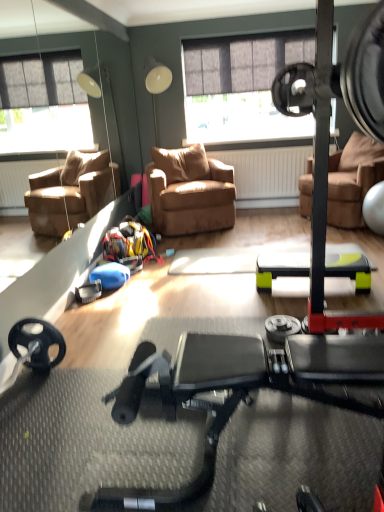
Question: Does brown leather chair at center, which is counted as the 2th chair, starting from the right, have a larger size compared to brown leather chair at center, the second chair from the left?

Choices:
 (A) no
 (B) yes

Answer: (A)

Question: From the image's perspective, is brown leather chair at center, the 1th chair positioned from the left, over brown leather chair at center, the 1th chair in the right-to-left sequence?

Choices:
 (A) yes
 (B) no

Answer: (B)

Question: Is brown leather chair at center, which is counted as the 2th chair, starting from the right, next to brown leather chair at center, the second chair from the left, and touching it?

Choices:
 (A) yes
 (B) no

Answer: (B)

Question: Is brown leather chair at center, which is counted as the 2th chair, starting from the right, not inside brown leather chair at center, the second chair from the left?

Choices:
 (A) no
 (B) yes

Answer: (B)

Question: Does brown leather chair at center, the 1th chair positioned from the left, have a smaller size compared to brown leather chair at center, the 1th chair in the right-to-left sequence?

Choices:
 (A) no
 (B) yes

Answer: (B)

Question: Does brown leather chair at center, which is counted as the 2th chair, starting from the right, have a greater width compared to brown leather chair at center, the 1th chair in the right-to-left sequence?

Choices:
 (A) yes
 (B) no

Answer: (B)

Question: Considering the relative positions of black rubber stationary bicycle at center and brown leather chair at center, the 1th chair positioned from the left, in the image provided, is black rubber stationary bicycle at center behind brown leather chair at center, the 1th chair positioned from the left,?

Choices:
 (A) yes
 (B) no

Answer: (B)

Question: Does black rubber stationary bicycle at center have a larger size compared to brown leather chair at center, which is counted as the 2th chair, starting from the right?

Choices:
 (A) yes
 (B) no

Answer: (B)

Question: Is brown leather chair at center, which is counted as the 2th chair, starting from the right, at the back of black rubber stationary bicycle at center?

Choices:
 (A) yes
 (B) no

Answer: (B)

Question: Is black rubber stationary bicycle at center positioned in front of brown leather chair at center, the 1th chair positioned from the left?

Choices:
 (A) no
 (B) yes

Answer: (B)

Question: Does black rubber stationary bicycle at center appear on the left side of brown leather chair at center, which is counted as the 2th chair, starting from the right?

Choices:
 (A) no
 (B) yes

Answer: (A)

Question: Does black rubber stationary bicycle at center have a greater width compared to brown leather chair at center, the 1th chair positioned from the left?

Choices:
 (A) yes
 (B) no

Answer: (A)

Question: Is black rubber stationary bicycle at center at the back of brown leather chair at center, the 1th chair positioned from the left?

Choices:
 (A) no
 (B) yes

Answer: (A)